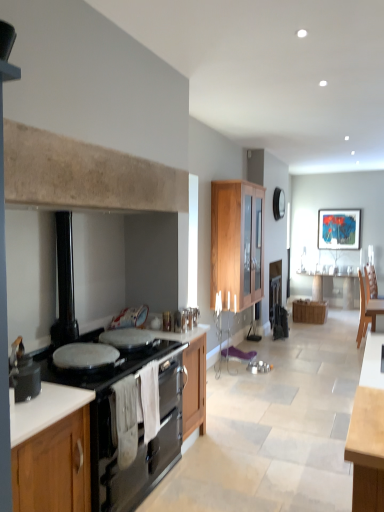
Question: Which direction should I rotate to look at wooden cabinet at center, acting as the 1th cabinetry starting from the back, — up or down?

Choices:
 (A) down
 (B) up

Answer: (A)

Question: Is black matte gas stove at lower left to the left of wooden chair at right from the viewer's perspective?

Choices:
 (A) yes
 (B) no

Answer: (A)

Question: Does black matte gas stove at lower left have a lesser height compared to wooden chair at right?

Choices:
 (A) no
 (B) yes

Answer: (B)

Question: Is black matte gas stove at lower left closer to camera compared to wooden chair at right?

Choices:
 (A) no
 (B) yes

Answer: (B)

Question: Can you confirm if black matte gas stove at lower left is taller than wooden chair at right?

Choices:
 (A) yes
 (B) no

Answer: (B)

Question: Is black matte gas stove at lower left at the right side of wooden chair at right?

Choices:
 (A) yes
 (B) no

Answer: (B)

Question: From a real-world perspective, is black matte gas stove at lower left below wooden chair at right?

Choices:
 (A) yes
 (B) no

Answer: (B)

Question: Would you say wooden cabinet at center, marked as the 2th cabinetry in a back-to-front arrangement, is part of white glossy countertop at lower left, marked as the first countertop in a bottom-to-top arrangement,'s contents?

Choices:
 (A) yes
 (B) no

Answer: (B)

Question: Is white glossy countertop at lower left, marked as the first countertop in a bottom-to-top arrangement, at the right side of wooden cabinet at center, the 2th cabinetry in the right-to-left sequence?

Choices:
 (A) yes
 (B) no

Answer: (B)

Question: Can you confirm if white glossy countertop at lower left, which is counted as the first countertop, starting from the back, is taller than wooden cabinet at center, the first cabinetry from the top?

Choices:
 (A) no
 (B) yes

Answer: (A)

Question: Are white glossy countertop at lower left, the 2th countertop from the top, and wooden cabinet at center, marked as the 2th cabinetry in a back-to-front arrangement, making contact?

Choices:
 (A) yes
 (B) no

Answer: (B)

Question: Does white glossy countertop at lower left, marked as the first countertop in a bottom-to-top arrangement, have a larger size compared to wooden cabinet at center, the first cabinetry from the top?

Choices:
 (A) no
 (B) yes

Answer: (A)

Question: Is white glossy countertop at lower left, the 2th countertop from the top, wider than wooden cabinet at center, which appears as the third cabinetry when ordered from the bottom?

Choices:
 (A) yes
 (B) no

Answer: (A)

Question: Is wooden cabinet at lower left, the 1th cabinetry when ordered from left to right, at the back of black enamel stove at left?

Choices:
 (A) no
 (B) yes

Answer: (A)